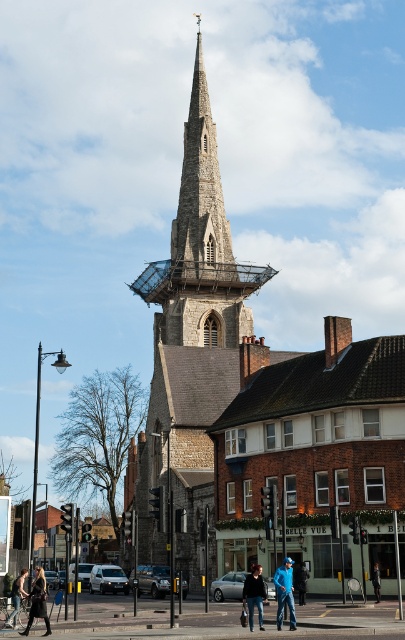
You are a pedestrian standing at the crosswalk and want to take a photo of the stone steeple at center without any people blocking it. The denim jacket at lower left is in your view. What should you do?

The denim jacket at lower left is behind the stone steeple at center, so you can take the photo without moving the denim jacket at lower left as it will be obscured by the steeple.